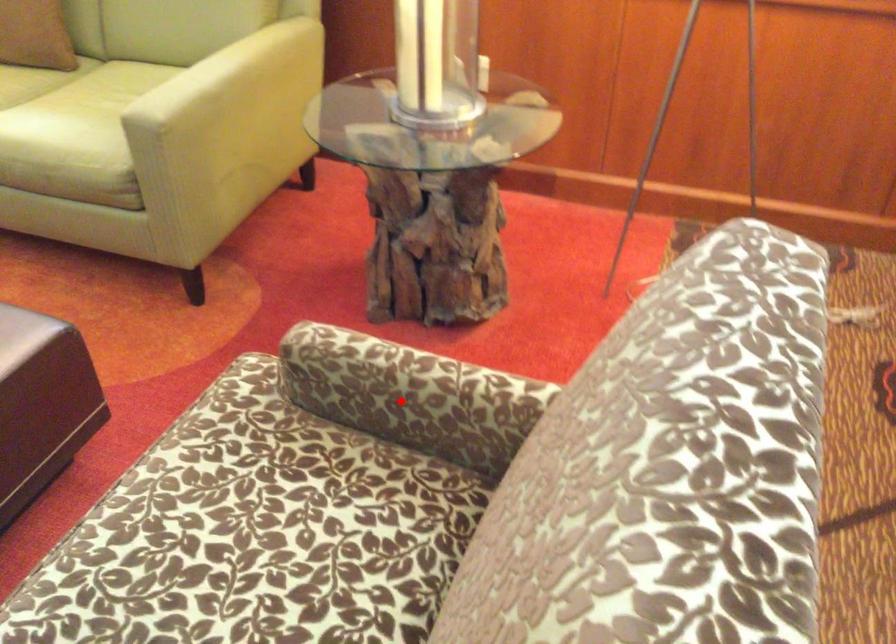
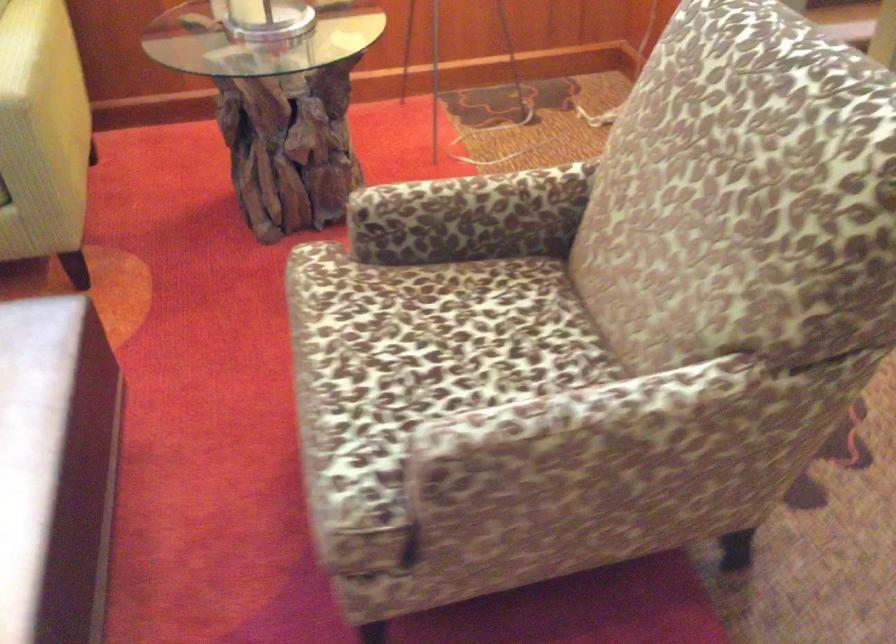
Question: I am providing you with two images of the same scene from different viewpoints. A red point is shown in image1. For the corresponding object point in image2, is it positioned nearer or farther from the camera?

Choices:
 (A) Nearer
 (B) Farther

Answer: (B)